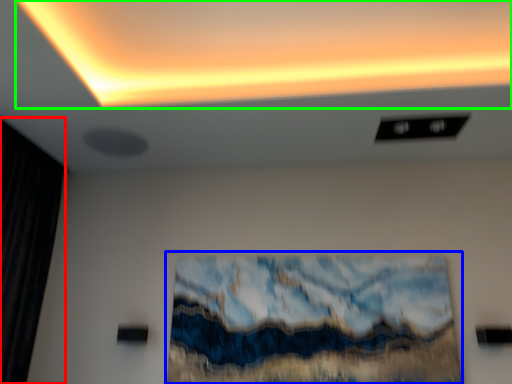
Question: Which object is the farthest from curtain (highlighted by a red box)? Choose among these: oil painting (highlighted by a blue box) or glow (highlighted by a green box).

Choices:
 (A) oil painting
 (B) glow

Answer: (A)